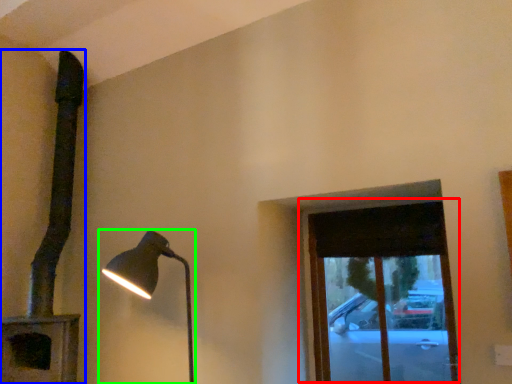
Question: Estimate the real-world distances between objects in this image. Which object is farther from window (highlighted by a red box), lamp (highlighted by a blue box) or lamp (highlighted by a green box)?

Choices:
 (A) lamp
 (B) lamp

Answer: (A)